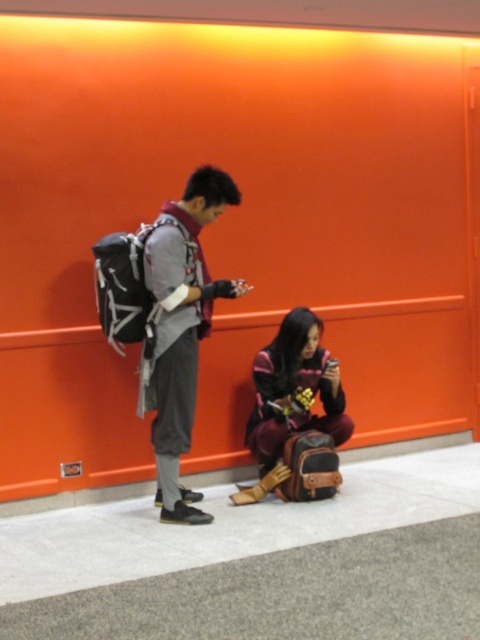
Question: Which object appears farthest from the camera in this image?

Choices:
 (A) maroon fabric bag at lower center
 (B) matte black backpack at left

Answer: (A)

Question: Which object appears closest to the camera in this image?

Choices:
 (A) matte black backpack at left
 (B) maroon fabric bag at lower center

Answer: (A)

Question: Can you confirm if matte black backpack at left is thinner than maroon fabric bag at lower center?

Choices:
 (A) yes
 (B) no

Answer: (A)

Question: Is matte black backpack at left above maroon fabric bag at lower center?

Choices:
 (A) no
 (B) yes

Answer: (B)

Question: Is matte black backpack at left further to the viewer compared to maroon fabric bag at lower center?

Choices:
 (A) no
 (B) yes

Answer: (A)